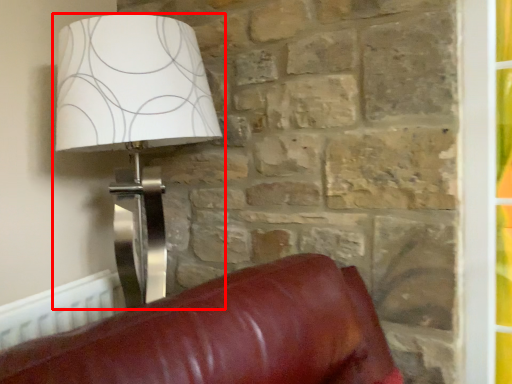
Question: From the image's perspective, where is lamp (annotated by the red box) located in relation to radiator in the image?

Choices:
 (A) below
 (B) above

Answer: (B)